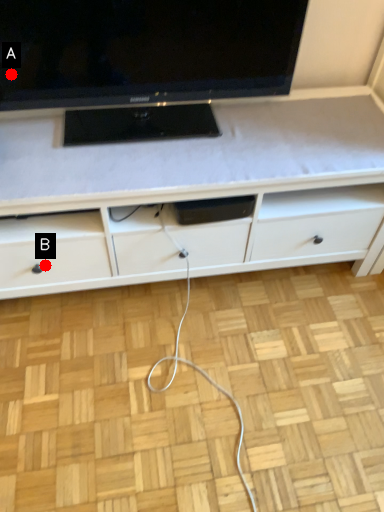
Question: Two points are circled on the image, labeled by A and B beside each circle. Which point is further to the camera?

Choices:
 (A) A is further
 (B) B is further

Answer: (B)